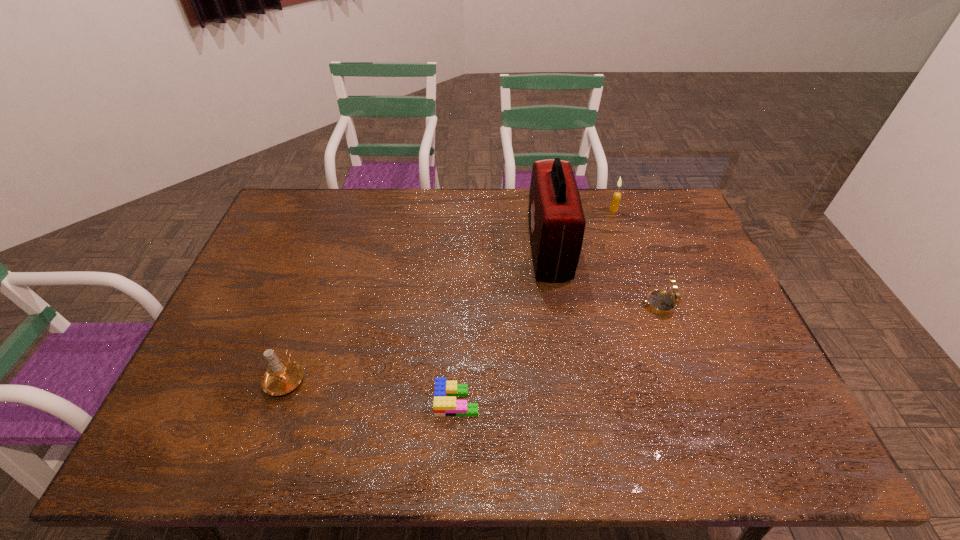
The image size is (960, 540). In order to click on blank space located 0.270m on the side of the first aid kit with the cross symbol in this screenshot , I will do `click(447, 249)`.

This screenshot has width=960, height=540. I want to click on vacant space located 0.080m on the side of the first aid kit with the cross symbol, so click(x=505, y=249).

Locate an element on the screen. free space located 0.120m on the side of the first aid kit with the cross symbol is located at coordinates (492, 249).

Locate an element on the screen. Image resolution: width=960 pixels, height=540 pixels. vacant space located 0.260m on the left of the farther candle is located at coordinates (538, 210).

Find the location of a particular element. vacant space located on the front of the nearer candle is located at coordinates (270, 422).

I want to click on vacant region located 0.390m with the dial facing the fourth tallest object, so click(x=506, y=305).

The width and height of the screenshot is (960, 540). What are the coordinates of `vacant space located 0.270m with the dial facing the fourth tallest object` in the screenshot? It's located at (547, 305).

Image resolution: width=960 pixels, height=540 pixels. In order to click on vacant space situated with the dial facing the fourth tallest object in this screenshot , I will do `click(615, 305)`.

Locate an element on the screen. The image size is (960, 540). blank area located 0.290m on the back of the fourth object from right to left is located at coordinates (461, 299).

You are a GUI agent. You are given a task and a screenshot of the screen. Output one action in this format:
    pyautogui.click(x=<x>, y=<y>)
    Task: Click on the first aid kit that is at the far edge
    The image size is (960, 540).
    Given the screenshot: What is the action you would take?
    pyautogui.click(x=556, y=219)